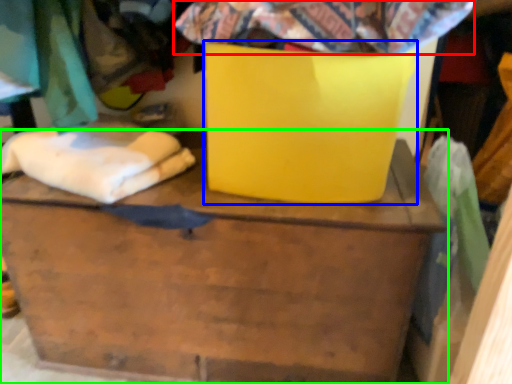
Question: Which is nearer to the fabric (highlighted by a red box)? cardboard box (highlighted by a blue box) or furniture (highlighted by a green box).

Choices:
 (A) cardboard box
 (B) furniture

Answer: (A)